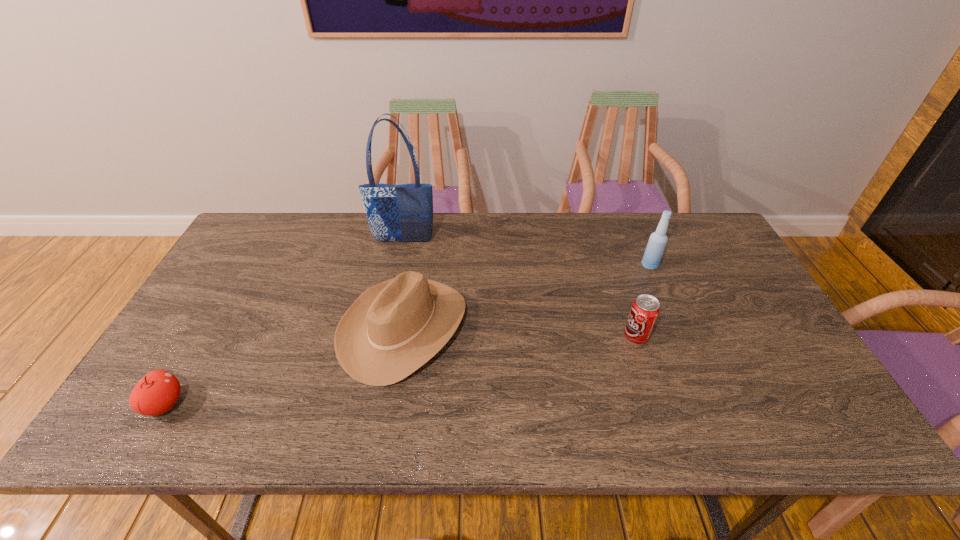
Locate an element on the screen. This screenshot has height=540, width=960. vacant space at the right edge is located at coordinates (715, 306).

Find the location of `vacant space at the far left corner of the desktop`. vacant space at the far left corner of the desktop is located at coordinates (273, 213).

At what (x,y) coordinates should I click in order to perform the action: click on vacant region between the cowboy hat and the leftmost object. Please return your answer as a coordinate pair (x, y). This screenshot has width=960, height=540. Looking at the image, I should click on (284, 366).

Find the location of a particular element. This screenshot has width=960, height=540. vacant area that lies between the cowboy hat and the fourth shortest object is located at coordinates (527, 296).

The width and height of the screenshot is (960, 540). I want to click on vacant region between the soda and the shopping bag, so click(519, 289).

Identify the location of free area in between the leftmost object and the cowboy hat. The width and height of the screenshot is (960, 540). (284, 366).

Locate an element on the screen. object that is the second closest to the rightmost object is located at coordinates (393, 328).

Where is `the fourth closest object relative to the bottle`? This screenshot has width=960, height=540. the fourth closest object relative to the bottle is located at coordinates (157, 392).

Find the location of a particular element. vacant space that satisfies the following two spatial constraints: 1. on the front-facing side of the cowboy hat; 2. on the left side of the farthest object is located at coordinates (386, 327).

The image size is (960, 540). I want to click on free region that satisfies the following two spatial constraints: 1. on the back side of the apple; 2. on the right side of the fourth nearest object, so click(246, 265).